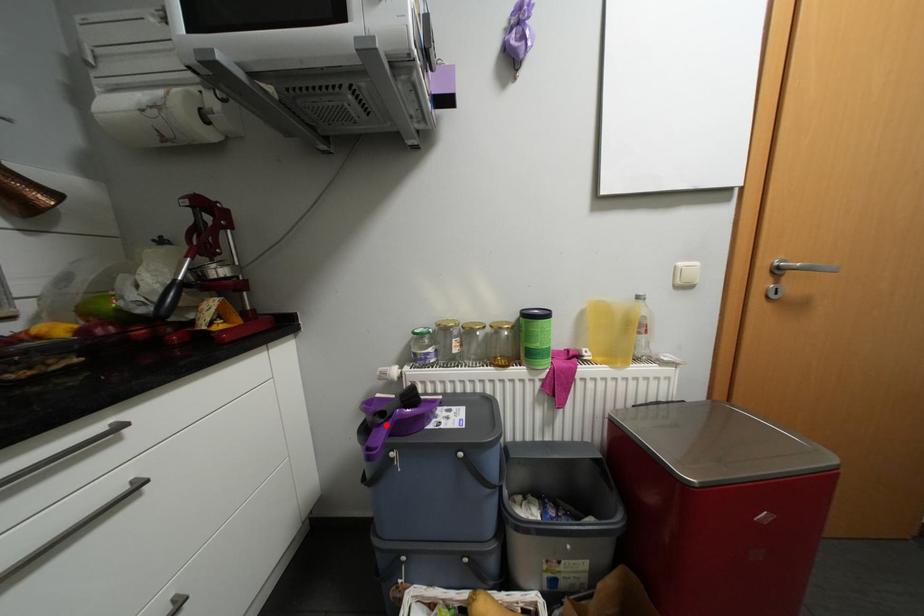
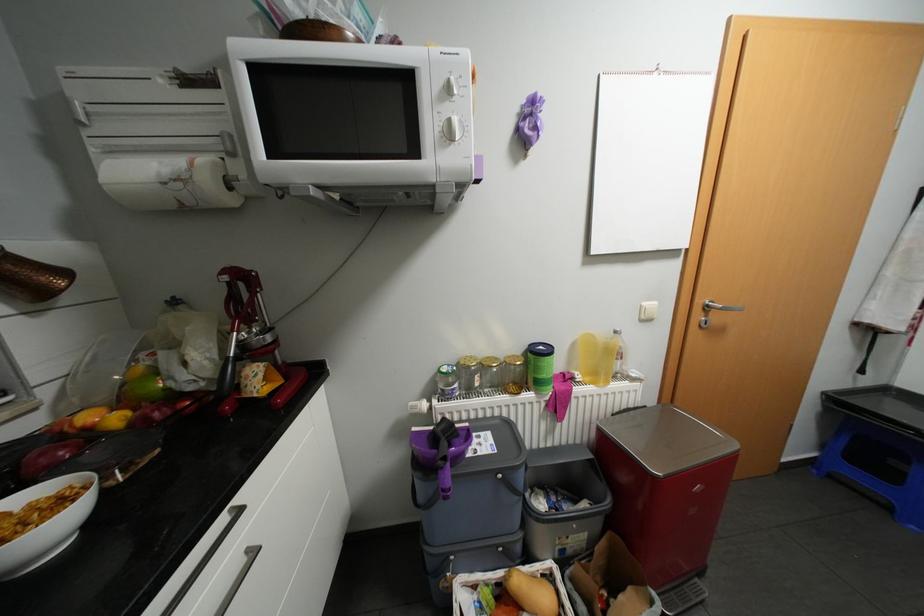
Where in the second image is the point corresponding to the highlighted location from the first image?

(450, 467)